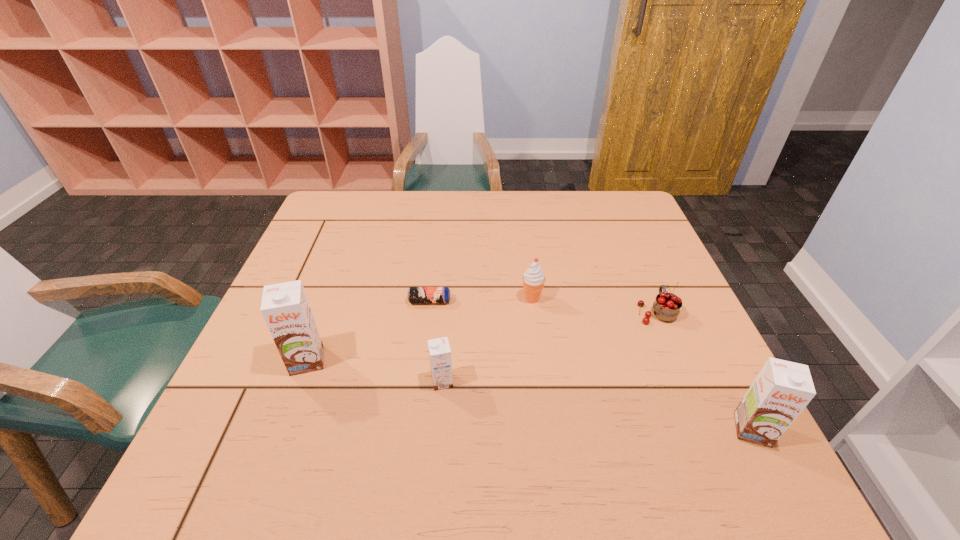
I want to click on free space located 0.270m on the back of the fifth shortest object, so click(x=694, y=314).

Locate an element on the screen. Image resolution: width=960 pixels, height=540 pixels. vacant space positioned on the back of the icecream is located at coordinates (525, 248).

At what (x,y) coordinates should I click in order to perform the action: click on vacant space located 0.230m on the left of the shortest object. Please return your answer as a coordinate pair (x, y). Looking at the image, I should click on (318, 301).

I want to click on vacant space located on the handle side of the second shortest object, so click(638, 268).

The image size is (960, 540). Identify the location of vacant space located 0.060m on the handle side of the second shortest object. (644, 283).

Locate an element on the screen. The height and width of the screenshot is (540, 960). vacant area located 0.360m on the handle side of the second shortest object is located at coordinates (617, 219).

What are the coordinates of `object positioned at the near edge` in the screenshot? It's located at (782, 389).

Where is `object located at the left edge`? object located at the left edge is located at coordinates (285, 307).

Identify the location of chocolate milk that is at the right edge. The width and height of the screenshot is (960, 540). (782, 389).

The height and width of the screenshot is (540, 960). Identify the location of cherry that is at the right edge. (667, 306).